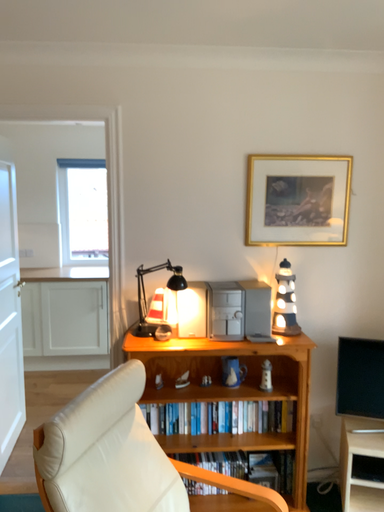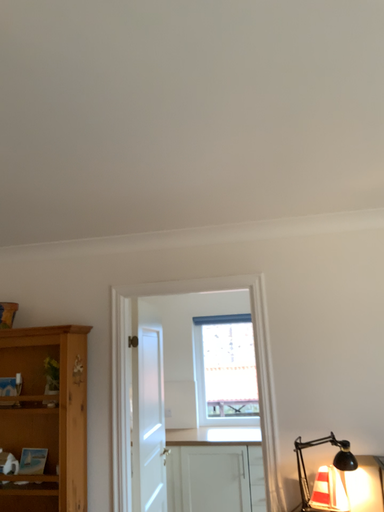
Question: Which way did the camera rotate in the video?

Choices:
 (A) rotated right
 (B) rotated left

Answer: (B)